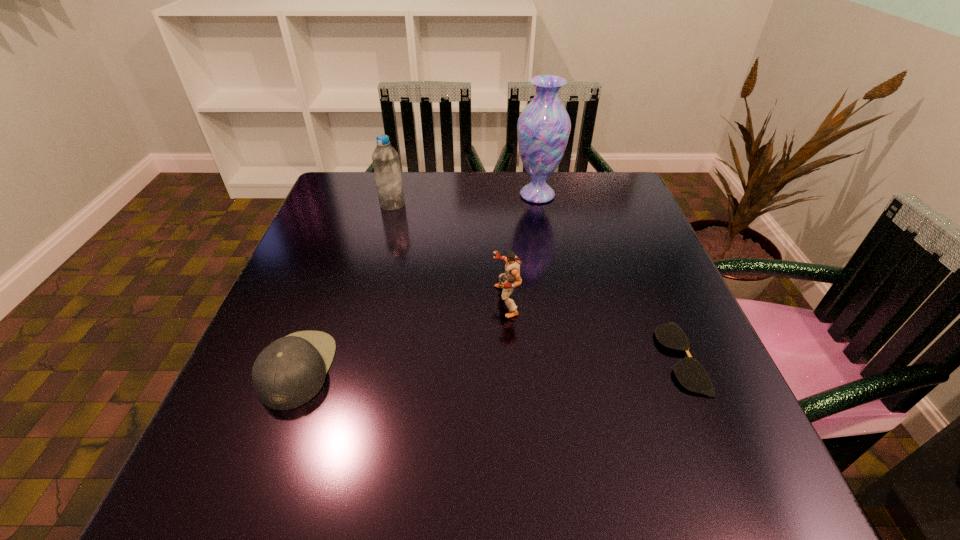
You are a GUI agent. You are given a task and a screenshot of the screen. Output one action in this format:
    pyautogui.click(x=<x>, y=<y>)
    Task: Click on the fourth object from left to right
    The width and height of the screenshot is (960, 540).
    Given the screenshot: What is the action you would take?
    pyautogui.click(x=543, y=128)

In order to click on the tallest object in this screenshot , I will do `click(543, 128)`.

Find the location of `the second tallest object`. the second tallest object is located at coordinates (385, 158).

I want to click on puncher, so click(511, 278).

The image size is (960, 540). Identify the location of the third object from left to right. 511,278.

Identify the location of cap. The image size is (960, 540). (289, 372).

You are a GUI agent. You are given a task and a screenshot of the screen. Output one action in this format:
    pyautogui.click(x=<x>, y=<y>)
    Task: Click on the rightmost object
    
    Given the screenshot: What is the action you would take?
    pyautogui.click(x=690, y=373)

The height and width of the screenshot is (540, 960). I want to click on the shortest object, so click(690, 373).

The image size is (960, 540). Identify the location of free region located 0.050m on the right of the vase. (579, 195).

Identify the location of vacant space located on the right of the water bottle. (490, 205).